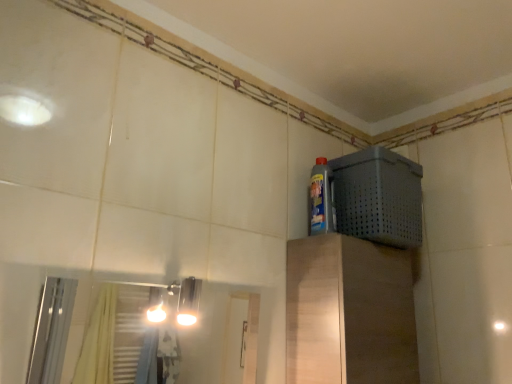
Question: From a real-world perspective, is gray perforated basket at upper right beneath blue glossy bottle at upper right?

Choices:
 (A) no
 (B) yes

Answer: (B)

Question: From the image's perspective, would you say gray perforated basket at upper right is shown under blue glossy bottle at upper right?

Choices:
 (A) yes
 (B) no

Answer: (A)

Question: Considering the relative sizes of gray perforated basket at upper right and blue glossy bottle at upper right in the image provided, is gray perforated basket at upper right thinner than blue glossy bottle at upper right?

Choices:
 (A) yes
 (B) no

Answer: (B)

Question: Can you confirm if gray perforated basket at upper right is positioned to the right of blue glossy bottle at upper right?

Choices:
 (A) no
 (B) yes

Answer: (B)

Question: Is gray perforated basket at upper right wider than blue glossy bottle at upper right?

Choices:
 (A) yes
 (B) no

Answer: (A)

Question: Is gray perforated basket at upper right turned away from blue glossy bottle at upper right?

Choices:
 (A) no
 (B) yes

Answer: (A)

Question: Is blue glossy bottle at upper right to the left of gray perforated basket at upper right from the viewer's perspective?

Choices:
 (A) yes
 (B) no

Answer: (A)

Question: From a real-world perspective, does blue glossy bottle at upper right stand above gray perforated basket at upper right?

Choices:
 (A) yes
 (B) no

Answer: (A)

Question: Is blue glossy bottle at upper right oriented away from gray perforated basket at upper right?

Choices:
 (A) yes
 (B) no

Answer: (B)

Question: Considering the relative sizes of blue glossy bottle at upper right and gray perforated basket at upper right in the image provided, is blue glossy bottle at upper right bigger than gray perforated basket at upper right?

Choices:
 (A) no
 (B) yes

Answer: (A)

Question: Is gray perforated basket at upper right a part of blue glossy bottle at upper right?

Choices:
 (A) no
 (B) yes

Answer: (A)

Question: Is blue glossy bottle at upper right positioned before gray perforated basket at upper right?

Choices:
 (A) yes
 (B) no

Answer: (B)

Question: Does point (322, 182) appear closer or farther from the camera than point (376, 160)?

Choices:
 (A) farther
 (B) closer

Answer: (A)